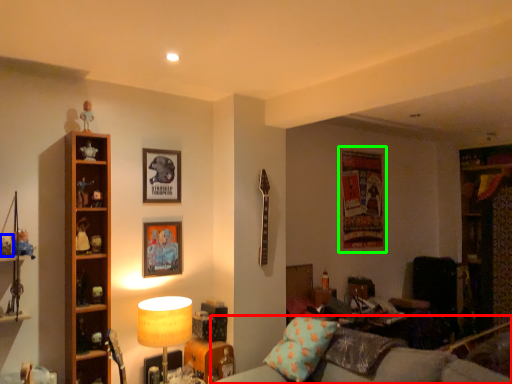
Question: Estimate the real-world distances between objects in this image. Which object is farther from studio couch (highlighted by a red box), toy (highlighted by a blue box) or picture frame (highlighted by a green box)?

Choices:
 (A) toy
 (B) picture frame

Answer: (A)